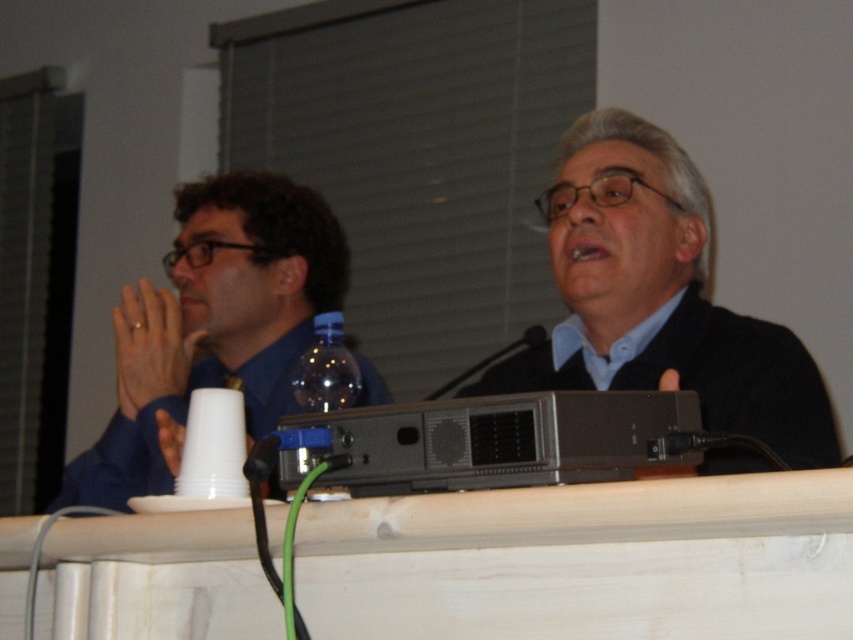
Does black matte suit at center appear over black plastic microphone at center?

Yes.

At what (x,y) coordinates should I click in order to perform the action: click on black matte suit at center. Please return your answer as a coordinate pair (x, y). Looking at the image, I should click on (659, 298).

Which is above, translucent plastic bottle at center or white plastic cup at lower left?

translucent plastic bottle at center is higher up.

Does translucent plastic bottle at center appear on the left side of white plastic cup at lower left?

Incorrect, translucent plastic bottle at center is not on the left side of white plastic cup at lower left.

Is point (341, 397) positioned after point (155, 419)?

No, (341, 397) is closer to viewer.

Image resolution: width=853 pixels, height=640 pixels. I want to click on translucent plastic bottle at center, so click(x=326, y=369).

Is blue shirt at left wider than white plastic cup at lower left?

Yes, blue shirt at left is wider than white plastic cup at lower left.

Is blue shirt at left to the right of white plastic cup at lower left from the viewer's perspective?

No, blue shirt at left is not to the right of white plastic cup at lower left.

Between point (161, 461) and point (173, 445), which one is positioned behind?

The point (161, 461) is behind.

Locate an element on the screen. This screenshot has width=853, height=640. blue shirt at left is located at coordinates (213, 323).